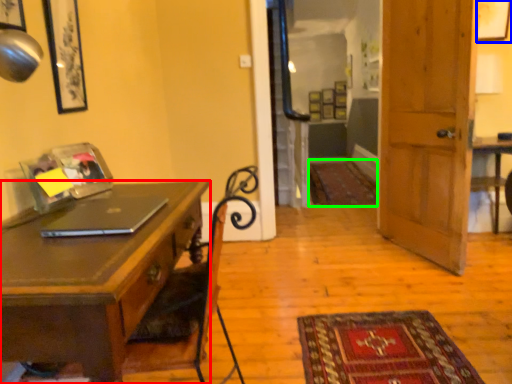
Question: Which object is positioned farthest from desk (highlighted by a red box)? Select from picture frame (highlighted by a blue box) and mat (highlighted by a green box).

Choices:
 (A) picture frame
 (B) mat

Answer: (B)